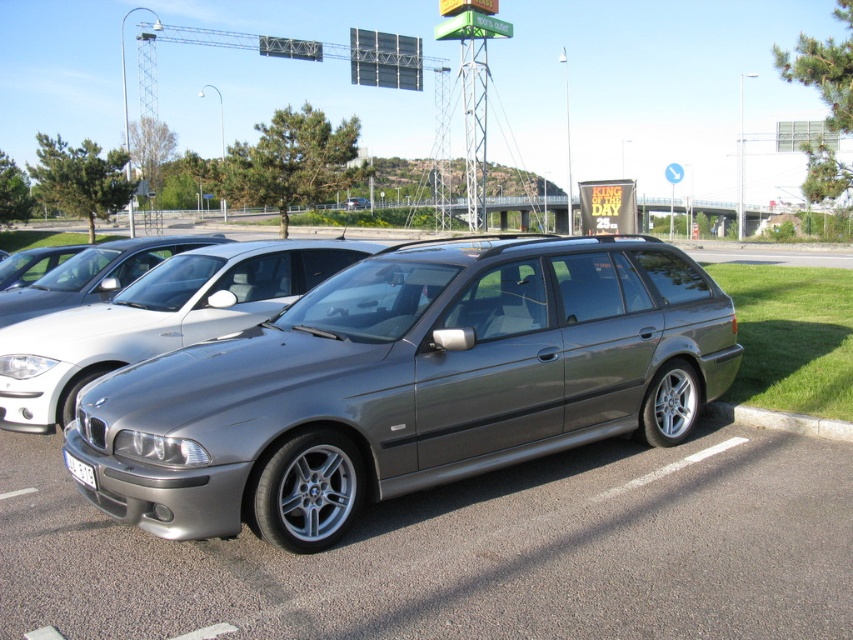
Measure the distance from satin metallic station wagon at center to gray concrete curb at lower right.

satin metallic station wagon at center is 4.86 meters from gray concrete curb at lower right.

Image resolution: width=853 pixels, height=640 pixels. Describe the element at coordinates (155, 320) in the screenshot. I see `satin metallic station wagon at center` at that location.

Between point (103, 340) and point (807, 435), which one is positioned behind?

Positioned behind is point (103, 340).

I want to click on satin metallic station wagon at center, so click(155, 320).

How far apart are satin metallic sedan at center and gray concrete curb at lower right?

satin metallic sedan at center is 3.97 meters away from gray concrete curb at lower right.

Is satin metallic sedan at center wider than gray concrete curb at lower right?

In fact, satin metallic sedan at center might be narrower than gray concrete curb at lower right.

At what (x,y) coordinates should I click in order to perform the action: click on satin metallic sedan at center. Please return your answer as a coordinate pair (x, y). Image resolution: width=853 pixels, height=640 pixels. Looking at the image, I should click on (407, 385).

Where is `satin metallic sedan at center`? Image resolution: width=853 pixels, height=640 pixels. satin metallic sedan at center is located at coordinates (407, 385).

Does satin silver wagon at center come in front of white plastic license plate at front?

That is False.

Does satin silver wagon at center appear on the left side of white plastic license plate at front?

Yes, satin silver wagon at center is to the left of white plastic license plate at front.

You are a GUI agent. You are given a task and a screenshot of the screen. Output one action in this format:
    pyautogui.click(x=<x>, y=<y>)
    Task: Click on the satin silver wagon at center
    
    Given the screenshot: What is the action you would take?
    pyautogui.click(x=94, y=275)

The image size is (853, 640). What are the coordinates of `satin silver wagon at center` in the screenshot? It's located at (94, 275).